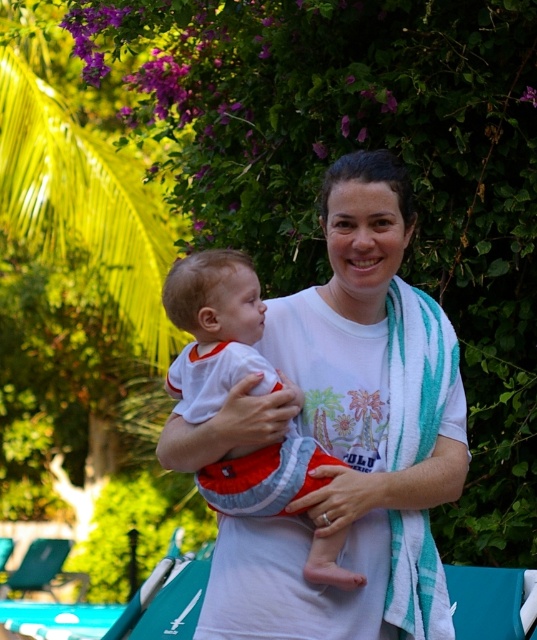
Question: Is white cotton shirt at center positioned in front of white cotton baby at center?

Choices:
 (A) yes
 (B) no

Answer: (A)

Question: Which object is closer to the camera taking this photo?

Choices:
 (A) white cotton shirt at center
 (B) white cotton baby at center

Answer: (A)

Question: Is white cotton shirt at center positioned before white cotton baby at center?

Choices:
 (A) no
 (B) yes

Answer: (B)

Question: Can you confirm if white cotton shirt at center is positioned to the left of white cotton baby at center?

Choices:
 (A) no
 (B) yes

Answer: (A)

Question: Which object is farther from the camera taking this photo?

Choices:
 (A) white cotton baby at center
 (B) white cotton shirt at center

Answer: (A)